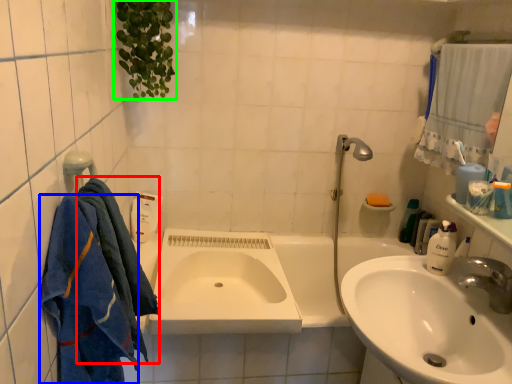
Question: Which is farther away from bath towel (highlighted by a red box)? bath towel (highlighted by a blue box) or plant (highlighted by a green box)?

Choices:
 (A) bath towel
 (B) plant

Answer: (B)